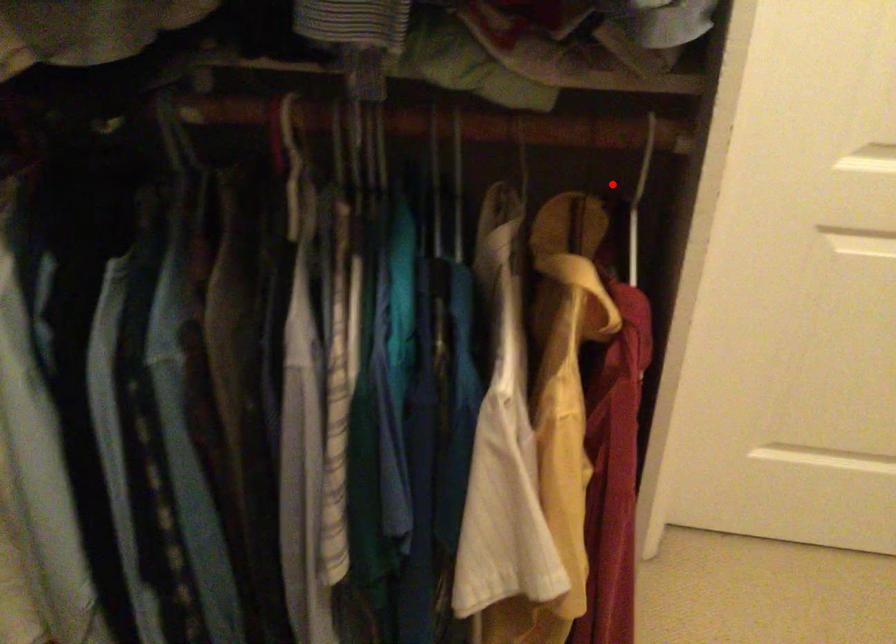
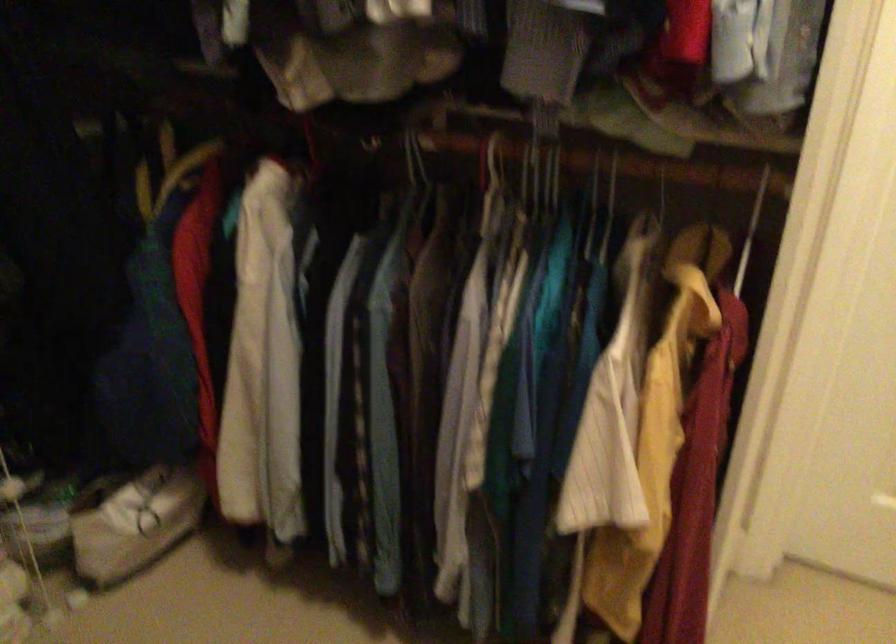
The point at the highlighted location is marked in the first image. Where is the corresponding point in the second image?

(751, 230)